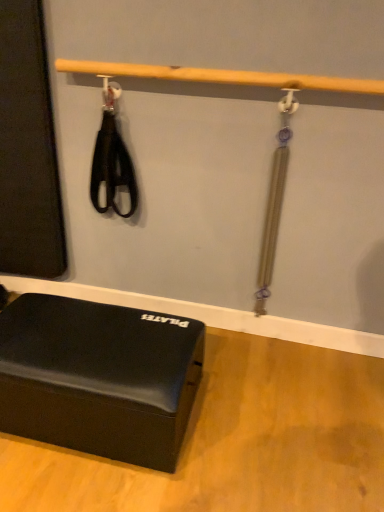
Question: From the image's perspective, is wooden bar at upper center positioned above or below matte black foam block at lower left?

Choices:
 (A) below
 (B) above

Answer: (B)

Question: Is wooden bar at upper center to the left or to the right of matte black foam block at lower left in the image?

Choices:
 (A) right
 (B) left

Answer: (A)

Question: Relative to matte black foam block at lower left, is wooden bar at upper center in front or behind?

Choices:
 (A) behind
 (B) front

Answer: (A)

Question: In terms of width, does matte black foam block at lower left look wider or thinner when compared to wooden bar at upper center?

Choices:
 (A) thin
 (B) wide

Answer: (B)

Question: In the image, is matte black foam block at lower left positioned in front of or behind wooden bar at upper center?

Choices:
 (A) front
 (B) behind

Answer: (A)

Question: From the image's perspective, is matte black foam block at lower left above or below wooden bar at upper center?

Choices:
 (A) above
 (B) below

Answer: (B)

Question: Considering the relative positions of matte black foam block at lower left and wooden bar at upper center in the image provided, is matte black foam block at lower left to the left or to the right of wooden bar at upper center?

Choices:
 (A) right
 (B) left

Answer: (B)